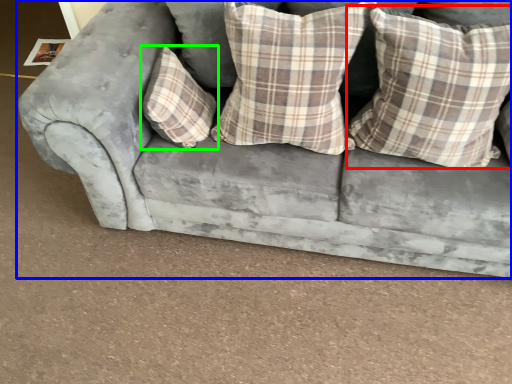
Question: Which is nearer to the pillow (highlighted by a red box)? studio couch (highlighted by a blue box) or pillow (highlighted by a green box).

Choices:
 (A) studio couch
 (B) pillow

Answer: (A)